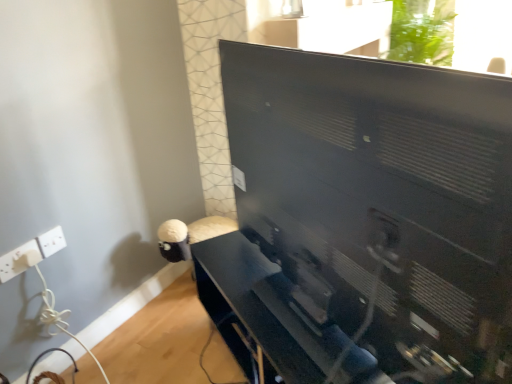
Question: From a real-world perspective, is white plastic electric outlet at lower left, which is counted as the 2th electric outlet, starting from the left, located beneath black matte computer monitor at center?

Choices:
 (A) no
 (B) yes

Answer: (B)

Question: Is white plastic electric outlet at lower left, which is counted as the 2th electric outlet, starting from the left, not close to black matte computer monitor at center?

Choices:
 (A) yes
 (B) no

Answer: (A)

Question: Does white plastic electric outlet at lower left, the 1th electric outlet viewed from the right, have a lesser height compared to black matte computer monitor at center?

Choices:
 (A) no
 (B) yes

Answer: (B)

Question: Is white plastic electric outlet at lower left, which is counted as the 2th electric outlet, starting from the left, bigger than black matte computer monitor at center?

Choices:
 (A) yes
 (B) no

Answer: (B)

Question: Is white plastic electric outlet at lower left, which is counted as the 2th electric outlet, starting from the left, touching black matte computer monitor at center?

Choices:
 (A) no
 (B) yes

Answer: (A)

Question: Is white plastic electric outlet at lower left, the 1th electric outlet when ordered from left to right, inside the boundaries of matte black tv stand at center, or outside?

Choices:
 (A) inside
 (B) outside

Answer: (B)

Question: In the image, is white plastic electric outlet at lower left, the 1th electric outlet when ordered from left to right, on the left side or the right side of matte black tv stand at center?

Choices:
 (A) left
 (B) right

Answer: (A)

Question: Does point (26, 249) appear closer or farther from the camera than point (349, 370)?

Choices:
 (A) closer
 (B) farther

Answer: (B)

Question: From the image's perspective, relative to matte black tv stand at center, is white plastic electric outlet at lower left, the 2th electric outlet viewed from the right, above or below?

Choices:
 (A) above
 (B) below

Answer: (A)

Question: In terms of width, does black matte computer monitor at center look wider or thinner when compared to matte black tv stand at center?

Choices:
 (A) wide
 (B) thin

Answer: (B)

Question: Is point (373, 324) closer or farther from the camera than point (269, 334)?

Choices:
 (A) farther
 (B) closer

Answer: (B)

Question: In terms of height, does black matte computer monitor at center look taller or shorter compared to matte black tv stand at center?

Choices:
 (A) tall
 (B) short

Answer: (A)

Question: From a real-world perspective, is black matte computer monitor at center physically located above or below matte black tv stand at center?

Choices:
 (A) below
 (B) above

Answer: (B)

Question: From a real-world perspective, is matte black tv stand at center positioned above or below white plastic electric outlet at lower left, the 2th electric outlet viewed from the right?

Choices:
 (A) below
 (B) above

Answer: (A)

Question: Based on their sizes in the image, would you say matte black tv stand at center is bigger or smaller than white plastic electric outlet at lower left, the 2th electric outlet viewed from the right?

Choices:
 (A) small
 (B) big

Answer: (B)